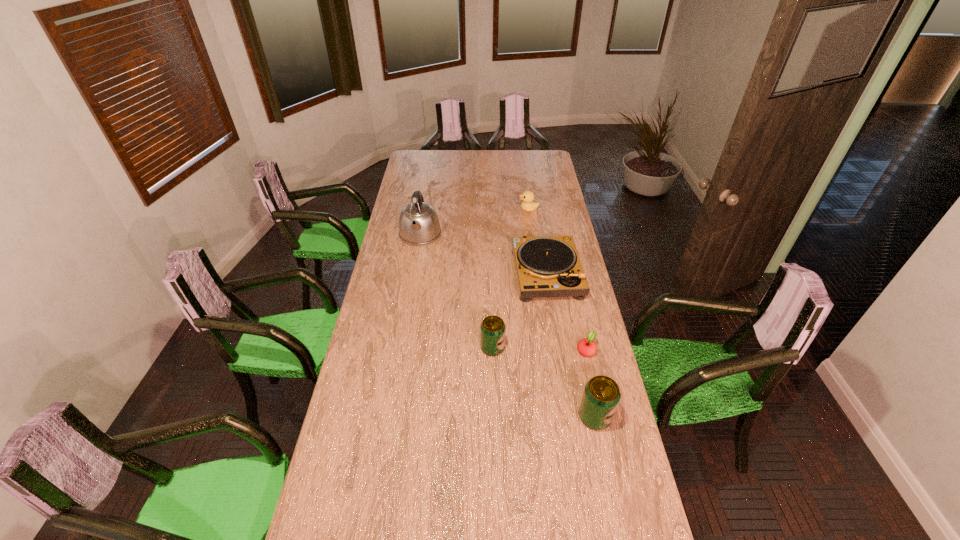
Identify the location of duck present at the right edge. This screenshot has width=960, height=540. pyautogui.click(x=528, y=205).

Find the location of `apple situated at the right edge`. apple situated at the right edge is located at coordinates (586, 347).

This screenshot has height=540, width=960. I want to click on free space at the far edge, so click(451, 154).

This screenshot has height=540, width=960. What are the coordinates of `vacant space at the left edge` in the screenshot? It's located at (371, 422).

Where is `free space at the right edge of the desktop`? Image resolution: width=960 pixels, height=540 pixels. free space at the right edge of the desktop is located at coordinates (568, 374).

You are a GUI agent. You are given a task and a screenshot of the screen. Output one action in this format:
    pyautogui.click(x=<x>, y=<y>)
    Task: Click on the vacant space at the far left corner of the desktop
    The width and height of the screenshot is (960, 540).
    Given the screenshot: What is the action you would take?
    pyautogui.click(x=407, y=156)

Locate an element on the screen. free spot at the far right corner of the desktop is located at coordinates (541, 166).

You are a GUI agent. You are given a task and a screenshot of the screen. Output one action in this format:
    pyautogui.click(x=<x>, y=<y>)
    Task: Click on the vacant area between the tallest object and the fifth shortest object
    The image size is (960, 540).
    Given the screenshot: What is the action you would take?
    pyautogui.click(x=508, y=326)

Identify the location of empty location between the taller beer can and the farthest object. (562, 313).

Locate an element on the screen. free point between the kettle and the nearer beer can is located at coordinates (508, 326).